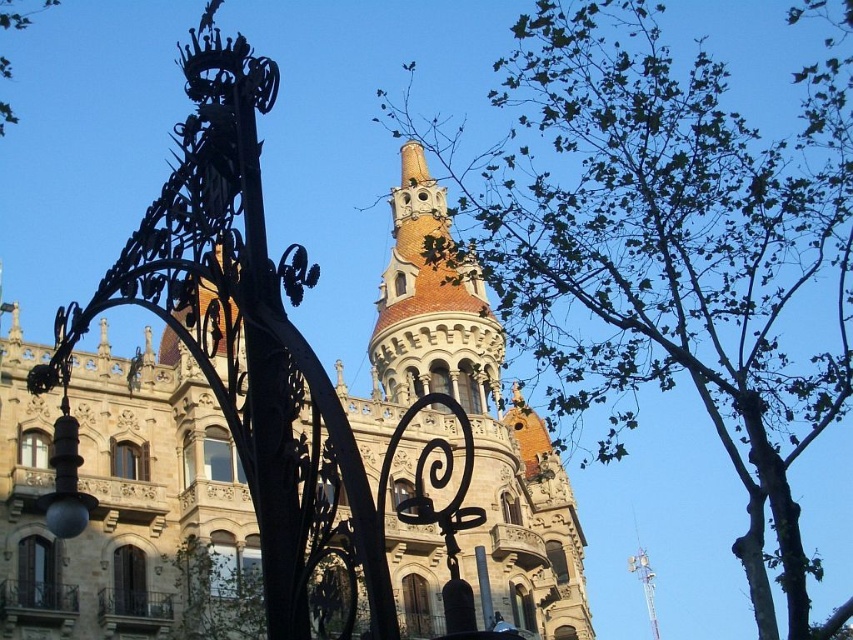
From the picture: Does green leafy tree at upper right appear on the left side of terracotta ceramic tower at center?

Incorrect, green leafy tree at upper right is not on the left side of terracotta ceramic tower at center.

Between point (746, 448) and point (399, 284), which one is positioned in front?

Positioned in front is point (399, 284).

Identify the location of green leafy tree at upper right. This screenshot has width=853, height=640. (665, 248).

Where is `green leafy tree at upper right`? The image size is (853, 640). green leafy tree at upper right is located at coordinates (665, 248).

Looking at this image, does terracotta ceramic tower at center have a lesser height compared to green leafy tree at upper left?

Yes, terracotta ceramic tower at center is shorter than green leafy tree at upper left.

In order to click on terracotta ceramic tower at center in this screenshot , I will do `click(430, 305)`.

Does point (775, 483) come farther from viewer compared to point (15, 10)?

That is False.

Between green leafy tree at upper right and green leafy tree at upper left, which one appears on the right side from the viewer's perspective?

green leafy tree at upper right

Which is behind, point (730, 250) or point (44, 4)?

Point (44, 4)

The height and width of the screenshot is (640, 853). What are the coordinates of `green leafy tree at upper right` in the screenshot? It's located at (665, 248).